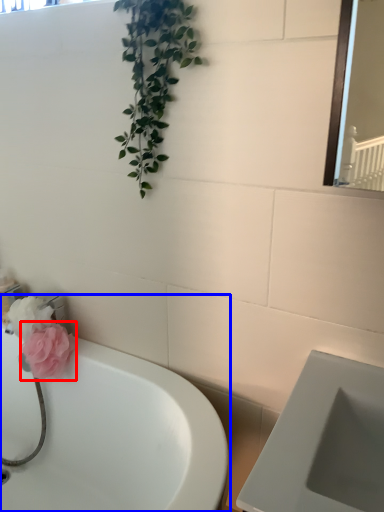
Question: Among these objects, which one is farthest to the camera, flower (highlighted by a red box) or bathtub (highlighted by a blue box)?

Choices:
 (A) flower
 (B) bathtub

Answer: (A)